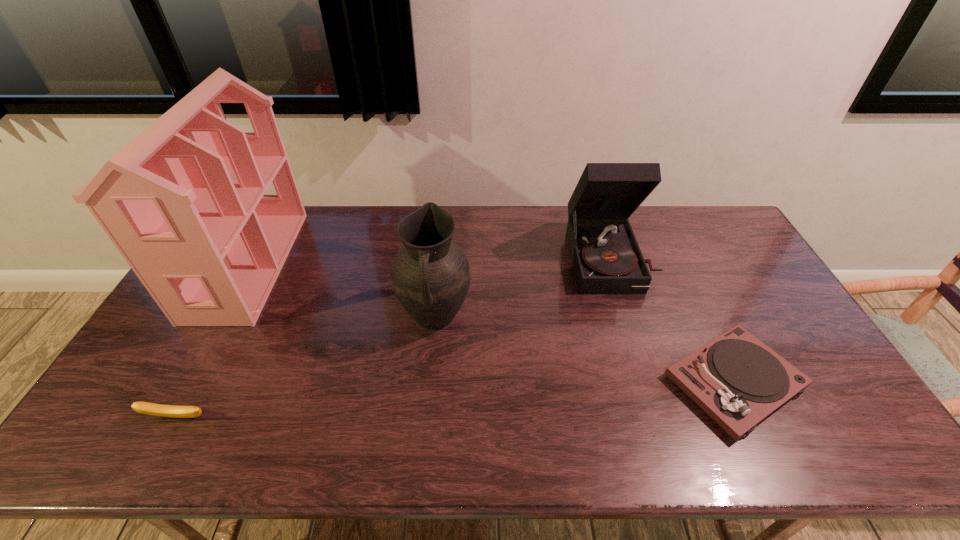
You are a GUI agent. You are given a task and a screenshot of the screen. Output one action in this format:
    pyautogui.click(x=<x>, y=<y>)
    Task: Click on the empty space between the third object from right to left and the taller phonograph_record
    
    Given the screenshot: What is the action you would take?
    pyautogui.click(x=522, y=287)

The image size is (960, 540). What are the coordinates of `free space between the shorter phonograph_record and the farther phonograph_record` in the screenshot? It's located at (672, 320).

Locate an element on the screen. Image resolution: width=960 pixels, height=540 pixels. vacant space that's between the taller phonograph_record and the shorter phonograph_record is located at coordinates (672, 320).

Where is `object that stands as the closest to the farther phonograph_record`? object that stands as the closest to the farther phonograph_record is located at coordinates (736, 379).

Select which object is the second closest to the pitcher. Please provide its 2D coordinates. Your answer should be formatted as a tuple, i.e. [(x, y)], where the tuple contains the x and y coordinates of a point satisfying the conditions above.

[(183, 202)]

You are a GUI agent. You are given a task and a screenshot of the screen. Output one action in this format:
    pyautogui.click(x=<x>, y=<y>)
    Task: Click on the free space that satisfies the following two spatial constraints: 1. on the front-facing side of the taller phonograph_record; 2. on the front-facing side of the tallest object
    Image resolution: width=960 pixels, height=540 pixels.
    Given the screenshot: What is the action you would take?
    pyautogui.click(x=612, y=264)

Where is `free location that satisfies the following two spatial constraints: 1. on the front-facing side of the farther phonograph_record; 2. on the front-facing side of the tallest object`? free location that satisfies the following two spatial constraints: 1. on the front-facing side of the farther phonograph_record; 2. on the front-facing side of the tallest object is located at coordinates (612, 264).

Where is `free space that satisfies the following two spatial constraints: 1. on the front-facing side of the taller phonograph_record; 2. on the front-facing side of the tallest object`? The width and height of the screenshot is (960, 540). free space that satisfies the following two spatial constraints: 1. on the front-facing side of the taller phonograph_record; 2. on the front-facing side of the tallest object is located at coordinates (612, 264).

The width and height of the screenshot is (960, 540). I want to click on vacant space that satisfies the following two spatial constraints: 1. on the front-facing side of the nearer phonograph_record; 2. on the left side of the taller phonograph_record, so click(x=650, y=382).